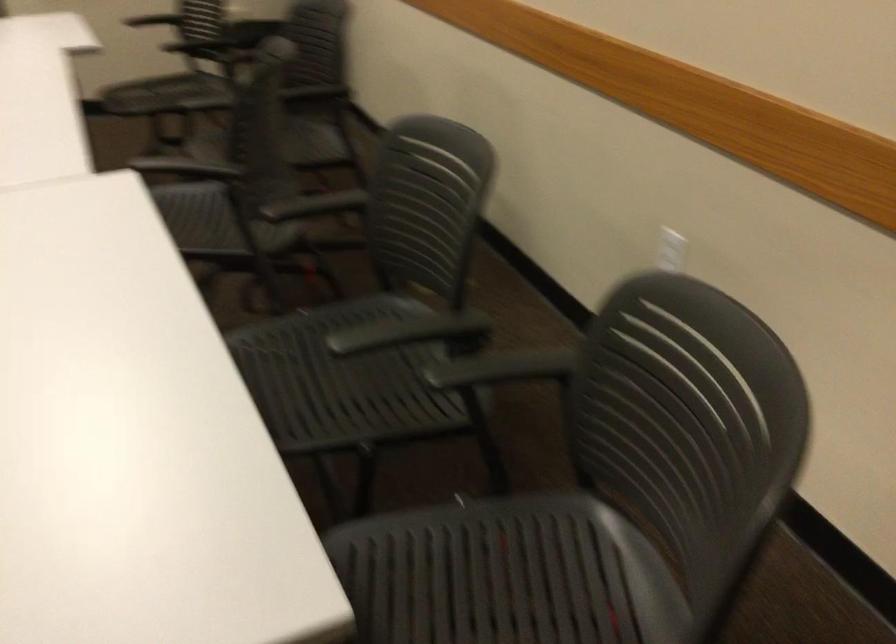
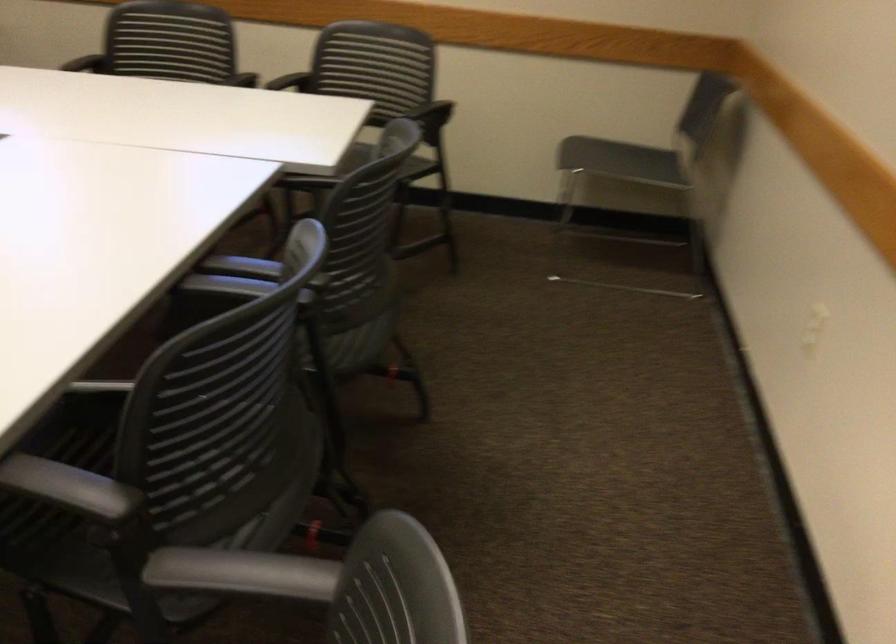
In the second image, find the point that corresponds to the point at 658,456 in the first image.

(375, 73)